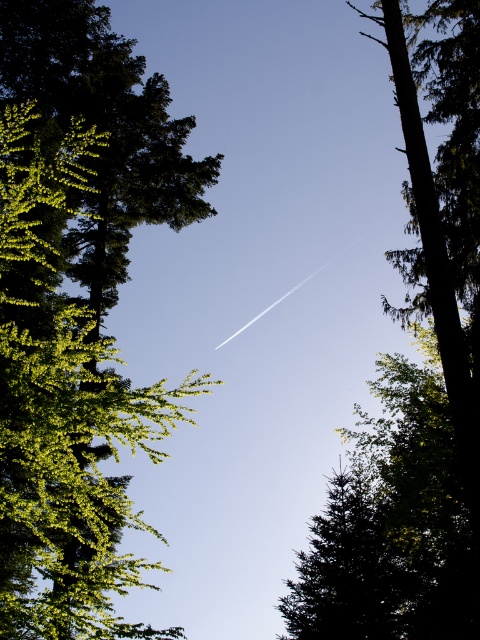
You are standing in the forest looking up at the sky. There is a point marked at coordinate [76,308]. What does this point represent?

The point at [76,308] represents the green leafy tree at upper left.

You are a bird flying through the forest. You notice two trees below you, the green leafy tree at upper left and the green textured tree at lower center. Which tree has a wider spread of branches?

→ The green leafy tree at upper left has a wider spread of branches than the green textured tree at lower center.

You are standing in the forest looking up and see the green leafy tree at upper left. If you want to take a photo of it, where should you aim your camera? Please provide the coordinates in the format of x,y where x and y are between 0 and 1.

The green leafy tree at upper left is located at coordinates (76, 308). Aim your camera there.